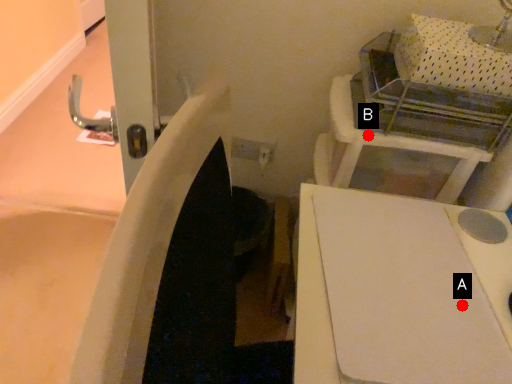
Question: Two points are circled on the image, labeled by A and B beside each circle. Which point is closer to the camera?

Choices:
 (A) A is closer
 (B) B is closer

Answer: (A)